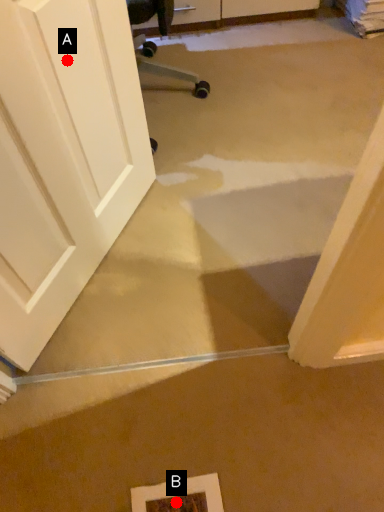
Question: Two points are circled on the image, labeled by A and B beside each circle. Which point is further to the camera?

Choices:
 (A) A is further
 (B) B is further

Answer: (B)